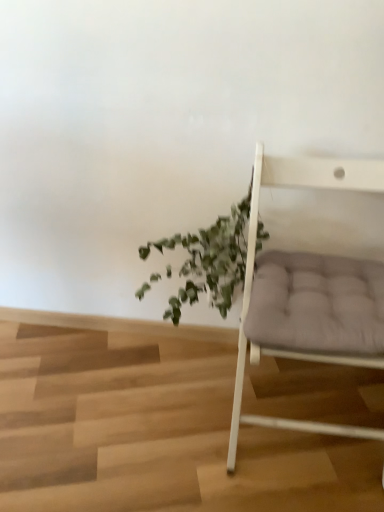
Question: Can you confirm if green leafy plant at center is thinner than matte gray cushion at right?

Choices:
 (A) yes
 (B) no

Answer: (A)

Question: Is green leafy plant at center to the left of matte gray cushion at right from the viewer's perspective?

Choices:
 (A) no
 (B) yes

Answer: (B)

Question: From a real-world perspective, is green leafy plant at center located higher than matte gray cushion at right?

Choices:
 (A) yes
 (B) no

Answer: (B)

Question: From the image's perspective, is green leafy plant at center above matte gray cushion at right?

Choices:
 (A) no
 (B) yes

Answer: (B)

Question: From the image's perspective, is green leafy plant at center below matte gray cushion at right?

Choices:
 (A) yes
 (B) no

Answer: (B)

Question: Is green leafy plant at center oriented towards matte gray cushion at right?

Choices:
 (A) no
 (B) yes

Answer: (A)

Question: From a real-world perspective, is matte gray cushion at right beneath green leafy plant at center?

Choices:
 (A) no
 (B) yes

Answer: (A)

Question: Is matte gray cushion at right positioned with its back to green leafy plant at center?

Choices:
 (A) yes
 (B) no

Answer: (B)

Question: Is there a large distance between matte gray cushion at right and green leafy plant at center?

Choices:
 (A) yes
 (B) no

Answer: (B)

Question: Is green leafy plant at center completely or partially inside matte gray cushion at right?

Choices:
 (A) no
 (B) yes

Answer: (A)

Question: Is matte gray cushion at right wider than green leafy plant at center?

Choices:
 (A) yes
 (B) no

Answer: (A)

Question: Does matte gray cushion at right have a lesser width compared to green leafy plant at center?

Choices:
 (A) no
 (B) yes

Answer: (A)

Question: Looking at their shapes, would you say matte gray cushion at right is wider or thinner than green leafy plant at center?

Choices:
 (A) thin
 (B) wide

Answer: (B)